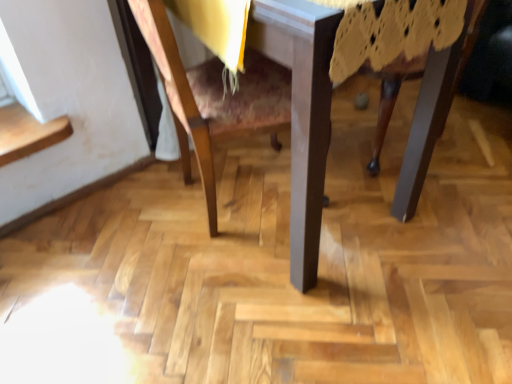
Locate an element on the screen. This screenshot has height=384, width=512. vacant region to the left of wooden chair at center is located at coordinates (106, 234).